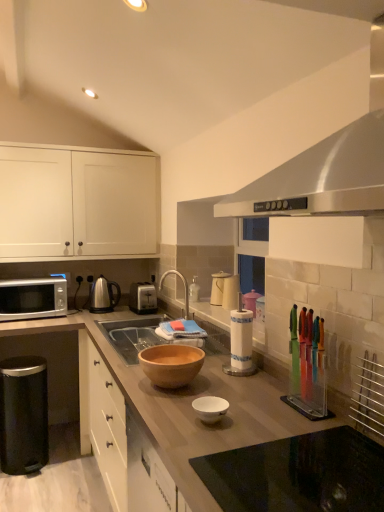
Locate an element on the screen. The width and height of the screenshot is (384, 512). vacant region under black matte trash can at lower left, the 3th appliance viewed from the back (from a real-world perspective) is located at coordinates (41, 463).